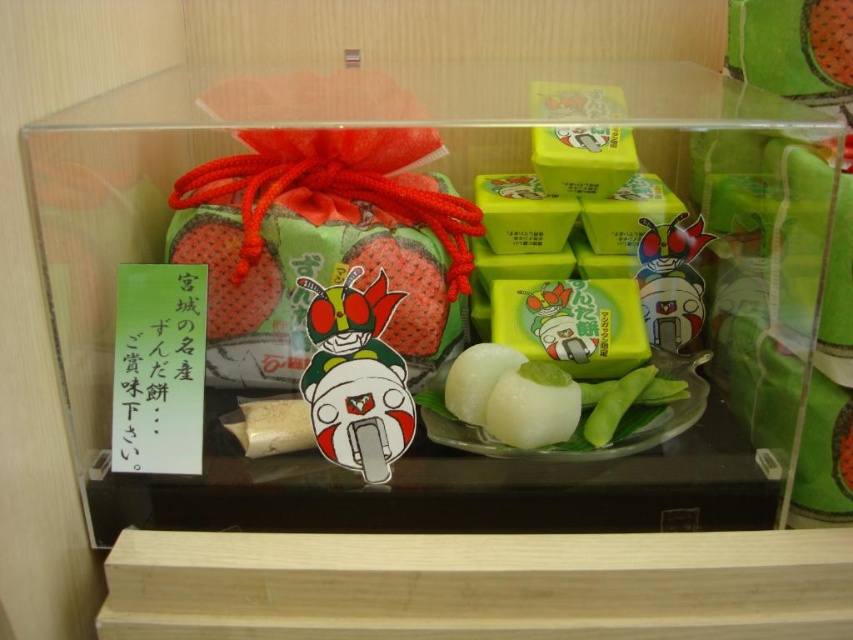
Can you confirm if transparent plastic box at center is positioned to the right of matte green strawberry at center?

Correct, you'll find transparent plastic box at center to the right of matte green strawberry at center.

In the scene shown: Who is shorter, transparent plastic box at center or matte green strawberry at center?

Standing shorter between the two is matte green strawberry at center.

Is point (628, 196) less distant than point (258, 316)?

No, (628, 196) is behind (258, 316).

I want to click on transparent plastic box at center, so click(x=445, y=291).

Describe the element at coordinates (357, 376) in the screenshot. I see `matte plastic toy at center` at that location.

Can you confirm if matte plastic toy at center is positioned to the left of smooth red strawberry at center?

Correct, you'll find matte plastic toy at center to the left of smooth red strawberry at center.

Who is more forward, (325,321) or (437,308)?

Point (325,321) is more forward.

The image size is (853, 640). What are the coordinates of `matte plastic toy at center` in the screenshot? It's located at (357, 376).

Who is more forward, (166, 147) or (318, 348)?

Point (318, 348) is in front.

Where is `transparent plastic box at center`? transparent plastic box at center is located at coordinates (445, 291).